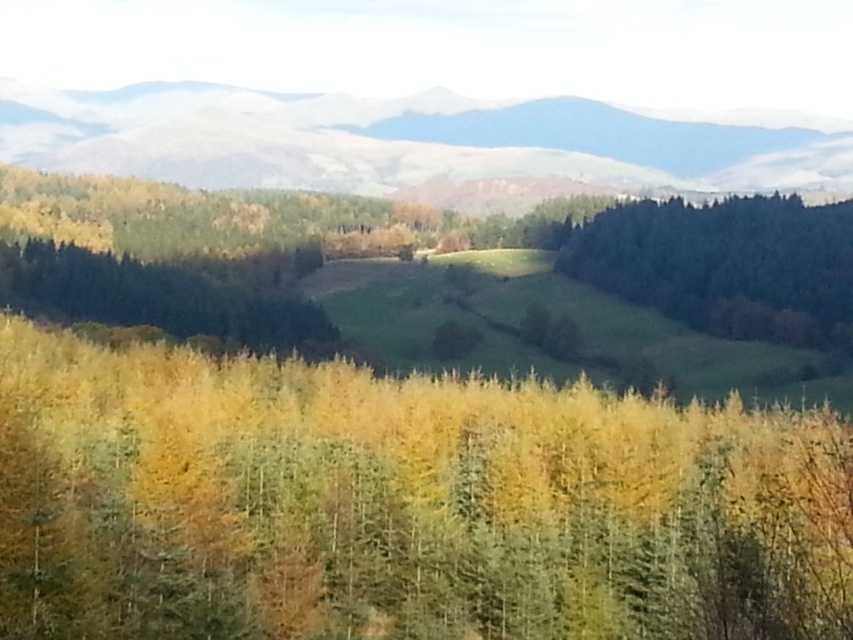
Question: Is yellow-green foliage at center below green matte trees at left?

Choices:
 (A) yes
 (B) no

Answer: (A)

Question: Considering the real-world distances, which object is closest to the snow-covered mountain at upper center?

Choices:
 (A) green matte tree at right
 (B) yellow-green foliage at center

Answer: (A)

Question: Which of the following is the closest to the observer?

Choices:
 (A) (173, 323)
 (B) (759, 310)
 (C) (811, 630)

Answer: (C)

Question: Which object is farther from the camera taking this photo?

Choices:
 (A) green matte trees at left
 (B) snow-covered mountain at upper center
 (C) yellow-green foliage at center
 (D) green matte tree at right

Answer: (B)

Question: Is yellow-green foliage at center above green matte tree at right?

Choices:
 (A) yes
 (B) no

Answer: (B)

Question: Can you confirm if snow-covered mountain at upper center is wider than green matte tree at right?

Choices:
 (A) yes
 (B) no

Answer: (A)